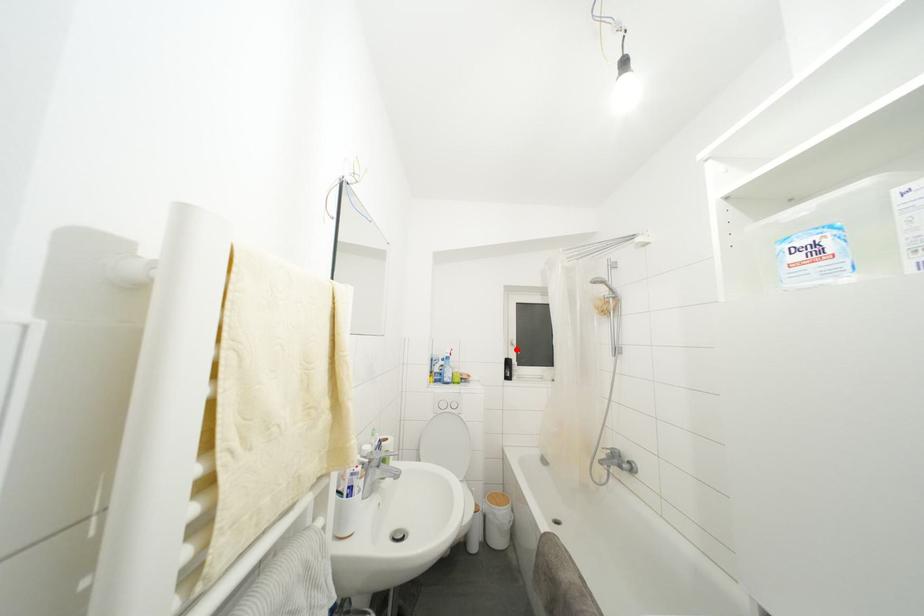
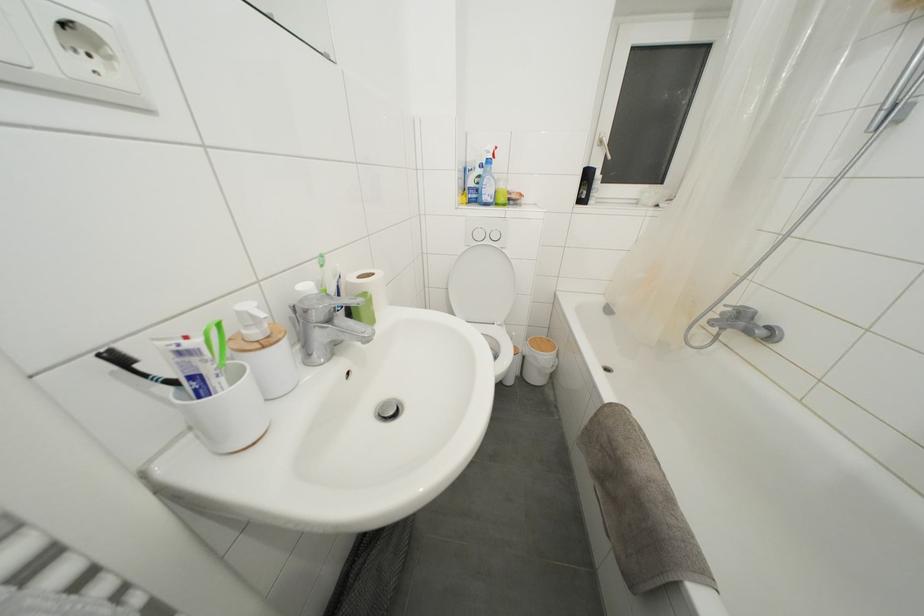
In the second image, find the point that corresponds to the highlighted location in the first image.

(604, 148)